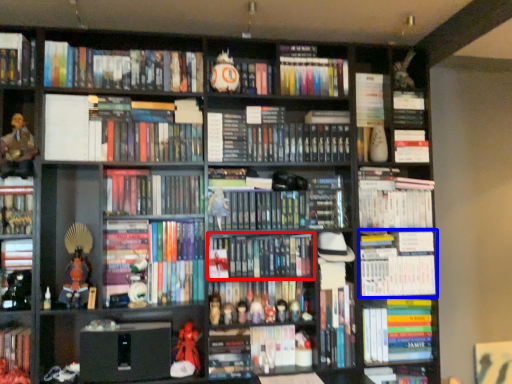
Question: Which object appears closest to the camera in this image, book (highlighted by a red box) or book (highlighted by a blue box)?

Choices:
 (A) book
 (B) book

Answer: (A)